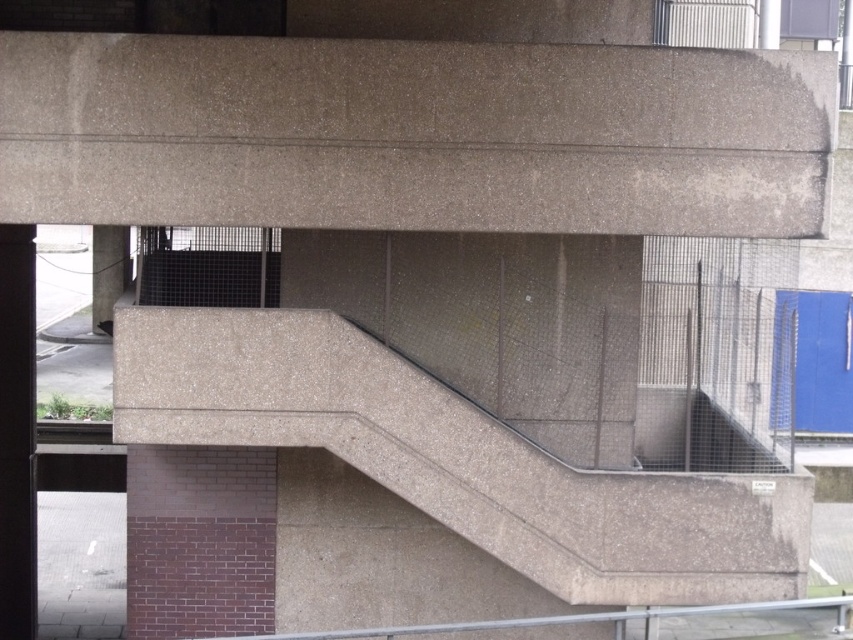
Consider the image. You are an architect assessing the structural integrity of the scene. You need to determine which object has a shorter vertical dimension between the concrete stairwell at center and the concrete pillar at lower left. Which one is shorter?

The concrete stairwell at center has a lesser height compared to the concrete pillar at lower left, so the concrete stairwell at center is shorter in vertical dimension.

You are standing at the base of the concrete pillar at lower left and want to reach the concrete stairwell at center. Which direction should you move to get there?

You should move to the right to reach the concrete stairwell at center from the concrete pillar at lower left since the stairwell is positioned to the right of the pillar.

You are standing at the base of the column and looking towards the overhang. There are two points marked on the structure. One is at coordinate point (18, 452) and the other at point (120, 230). Which point is closer to you?

Point (18, 452) is in front of point (120, 230), so it is closer to you.